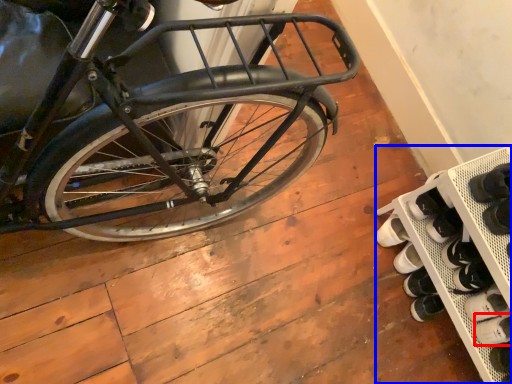
Question: Among these objects, which one is nearest to the camera, shoe (highlighted by a red box) or shelf (highlighted by a blue box)?

Choices:
 (A) shoe
 (B) shelf

Answer: (B)